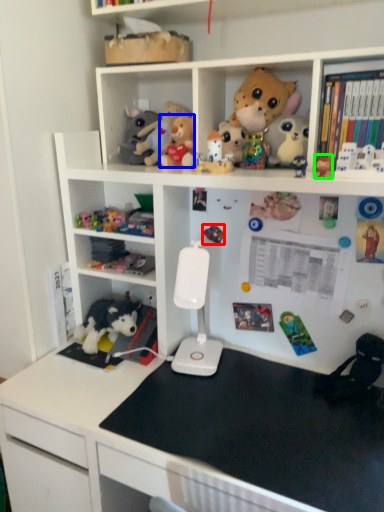
Question: Which object is positioned closest to toy (highlighted by a red box)? Select from toy (highlighted by a blue box) and toy (highlighted by a green box).

Choices:
 (A) toy
 (B) toy

Answer: (A)